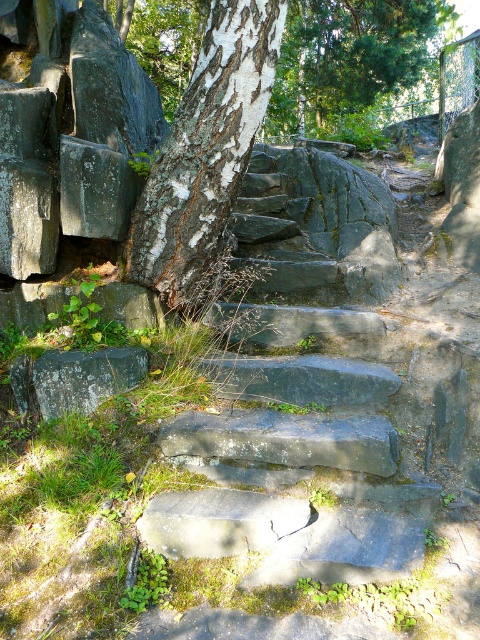
Question: Does smooth stone stairs at center appear under green textured tree at upper center?

Choices:
 (A) yes
 (B) no

Answer: (A)

Question: Which of the following is the closest to the observer?

Choices:
 (A) (446, 24)
 (B) (363, 173)

Answer: (B)

Question: Among these points, which one is farthest from the camera?

Choices:
 (A) (363, 1)
 (B) (342, 428)
 (C) (220, 180)

Answer: (A)

Question: Does smooth stone stairs at center have a larger size compared to white bark tree at center?

Choices:
 (A) no
 (B) yes

Answer: (B)

Question: Which of the following is the closest to the observer?

Choices:
 (A) green textured tree at upper center
 (B) white bark tree at center

Answer: (B)

Question: Is smooth stone stairs at center bigger than white bark tree at center?

Choices:
 (A) no
 (B) yes

Answer: (B)